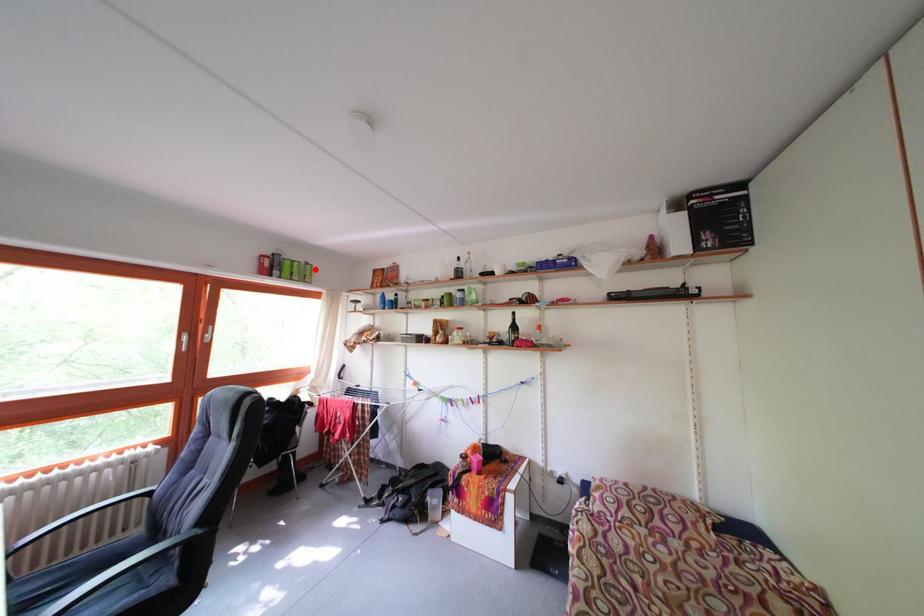
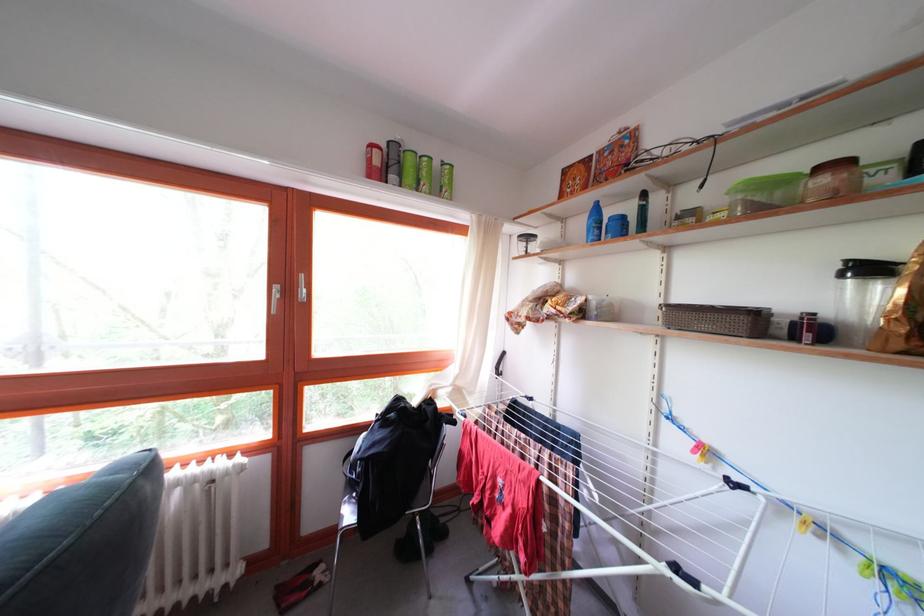
Where in the second image is the point corresponding to the highlighted location from the first image?

(452, 169)